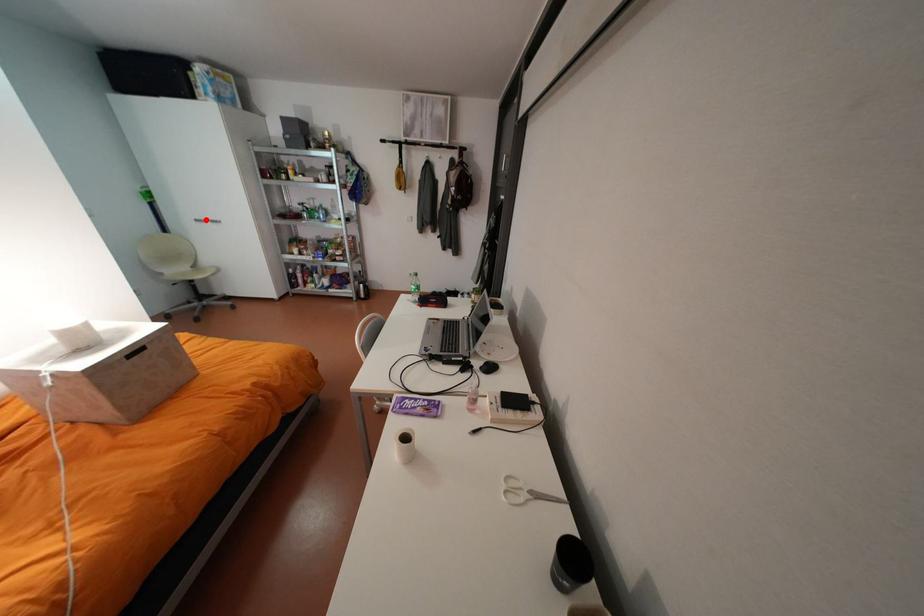
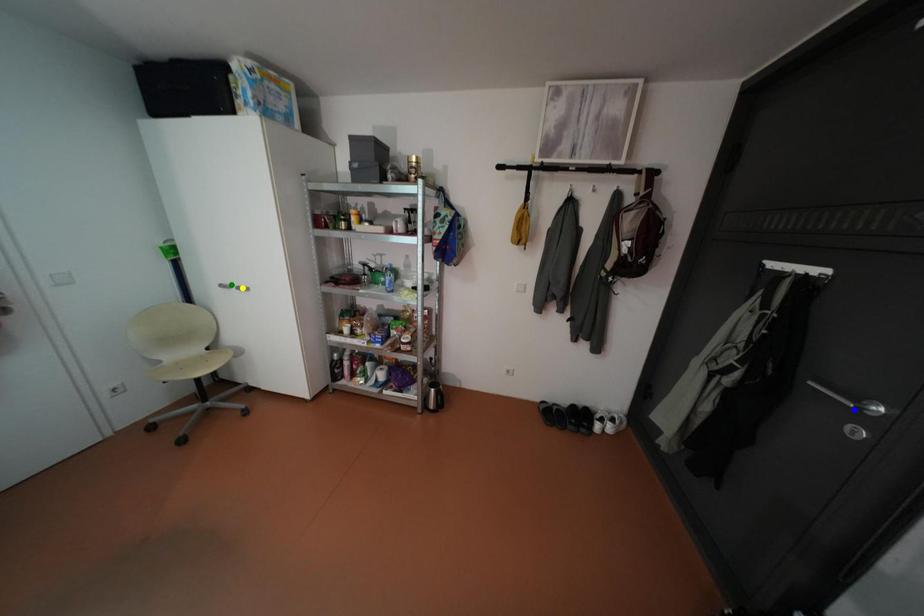
Question: I am providing you with two images of the same scene from different viewpoints. A red point is marked on the first image. You are given multiple points on the second image. Which mark in image 2 goes with the point in image 1?

Choices:
 (A) green point
 (B) blue point
 (C) yellow point

Answer: (A)